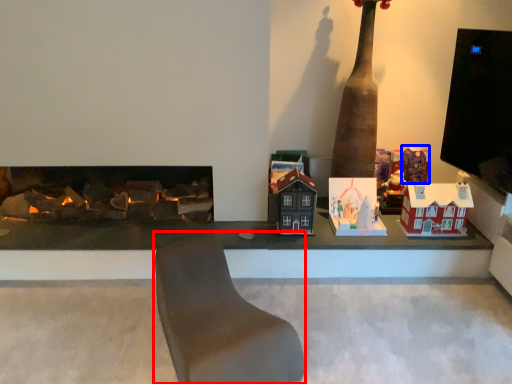
Question: Which of the following is the closest to the observer, furniture (highlighted by a red box) or toy (highlighted by a blue box)?

Choices:
 (A) furniture
 (B) toy

Answer: (A)